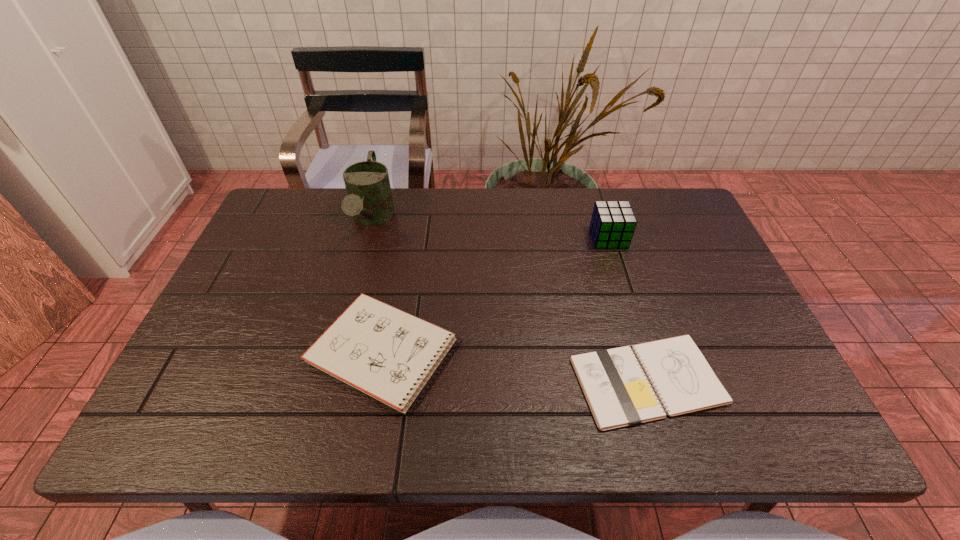
I want to click on watering can, so [x=369, y=200].

Where is `the second tallest object`? Image resolution: width=960 pixels, height=540 pixels. the second tallest object is located at coordinates (612, 225).

The height and width of the screenshot is (540, 960). I want to click on the left notepad, so point(388,354).

At what (x,y) coordinates should I click in order to perform the action: click on the taller notepad. Please return your answer as a coordinate pair (x, y). The width and height of the screenshot is (960, 540). Looking at the image, I should click on (388, 354).

Find the location of a particular element. The width and height of the screenshot is (960, 540). the right notepad is located at coordinates (618, 393).

Locate an element on the screen. The height and width of the screenshot is (540, 960). the shorter notepad is located at coordinates (618, 393).

Where is `vacant space located 0.180m with the spout on the tallest object`? Image resolution: width=960 pixels, height=540 pixels. vacant space located 0.180m with the spout on the tallest object is located at coordinates (349, 305).

This screenshot has height=540, width=960. Identify the location of vacant position located on the left of the third shortest object. (500, 238).

The image size is (960, 540). What are the coordinates of `free location located 0.080m on the right of the third tallest object` in the screenshot? It's located at (496, 352).

Find the location of `free spot located on the back of the right notepad`. free spot located on the back of the right notepad is located at coordinates (629, 318).